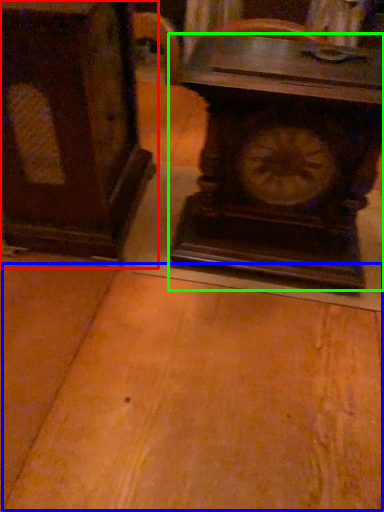
Question: Considering the real-world distances, which object is closest to furniture (highlighted by a red box)? table (highlighted by a blue box) or wall clock (highlighted by a green box).

Choices:
 (A) table
 (B) wall clock

Answer: (B)